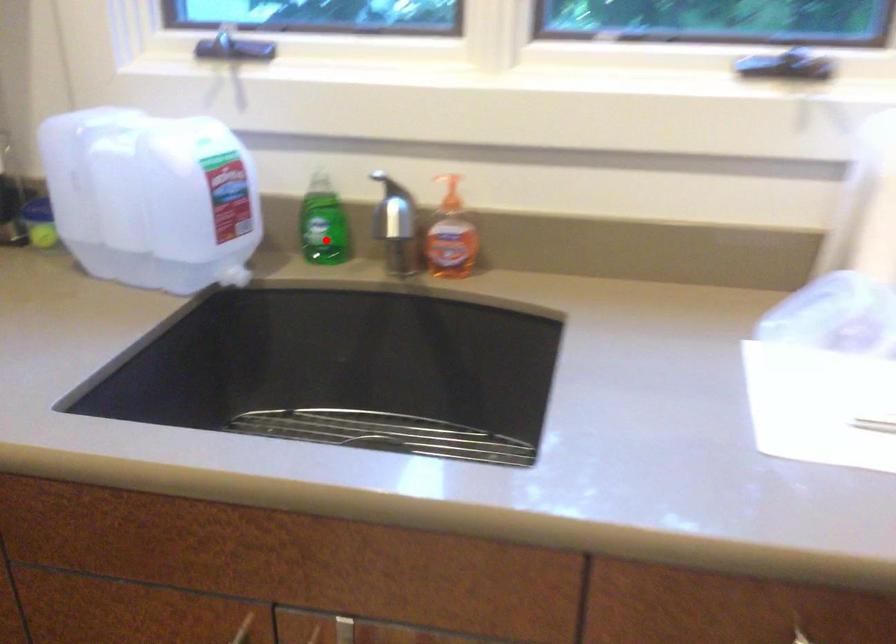
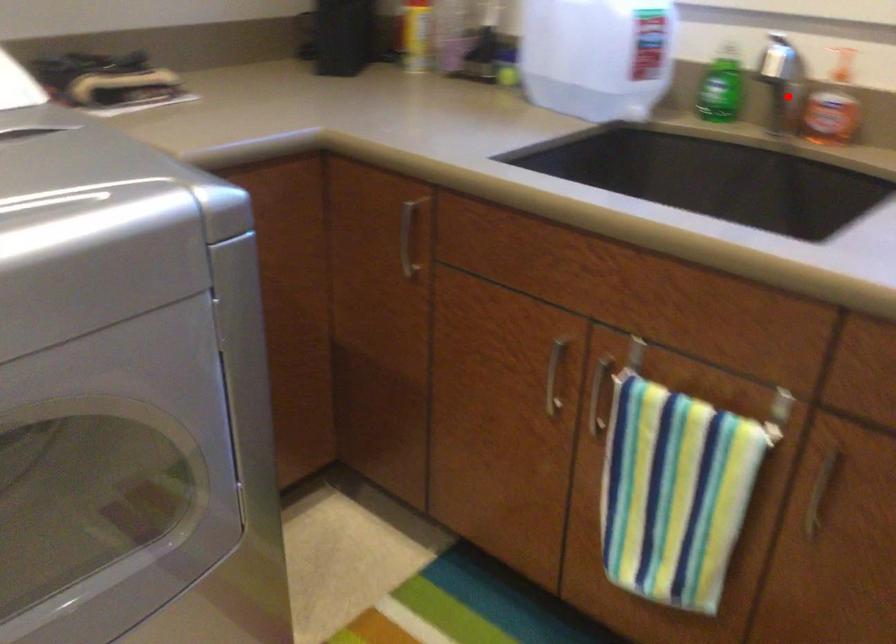
I am providing you with two images of the same scene from different viewpoints. A red point is marked on the first image and another point is marked on the second image. Does the point marked in image1 correspond to the same location as the one in image2?

No